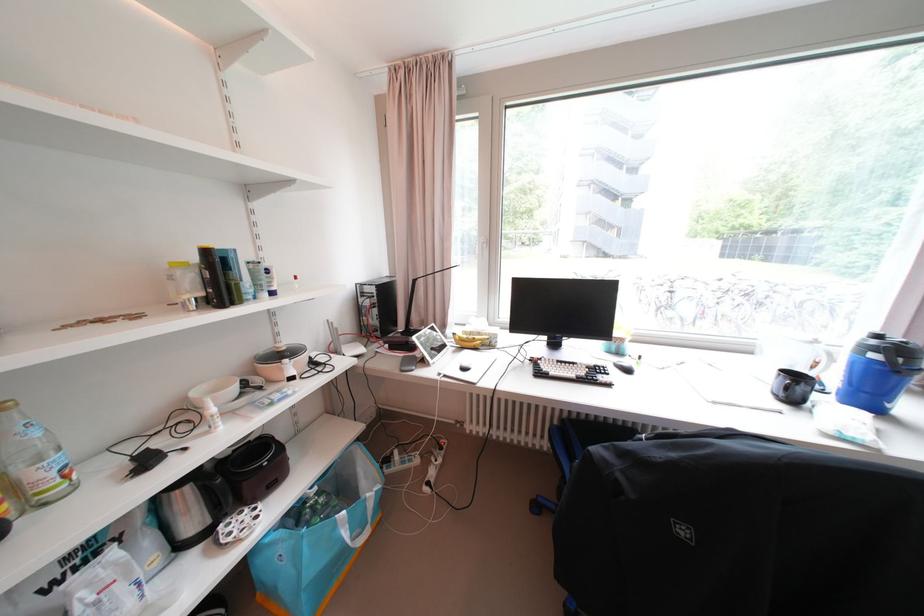
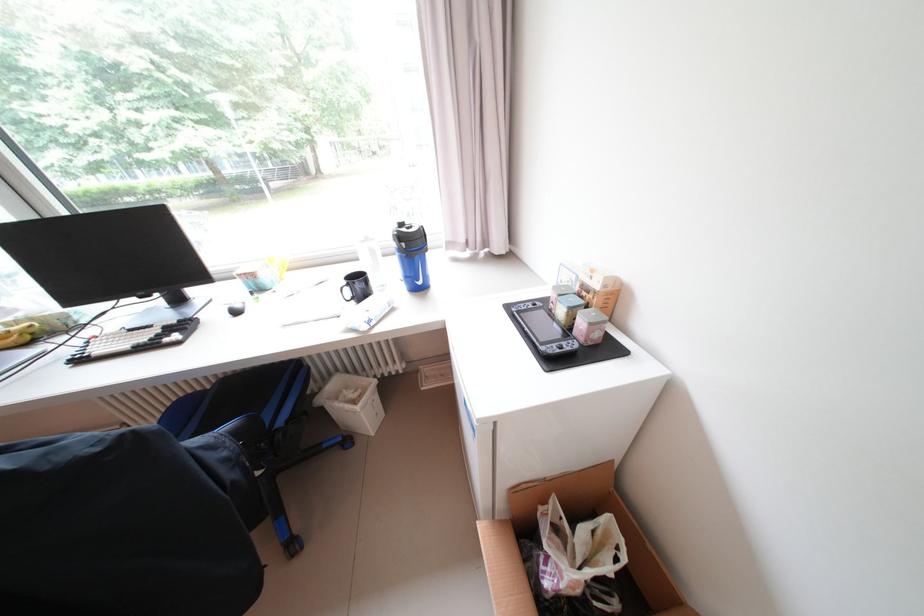
Locate, in the second image, the point that corresponds to the point at 896,407 in the first image.

(428, 284)